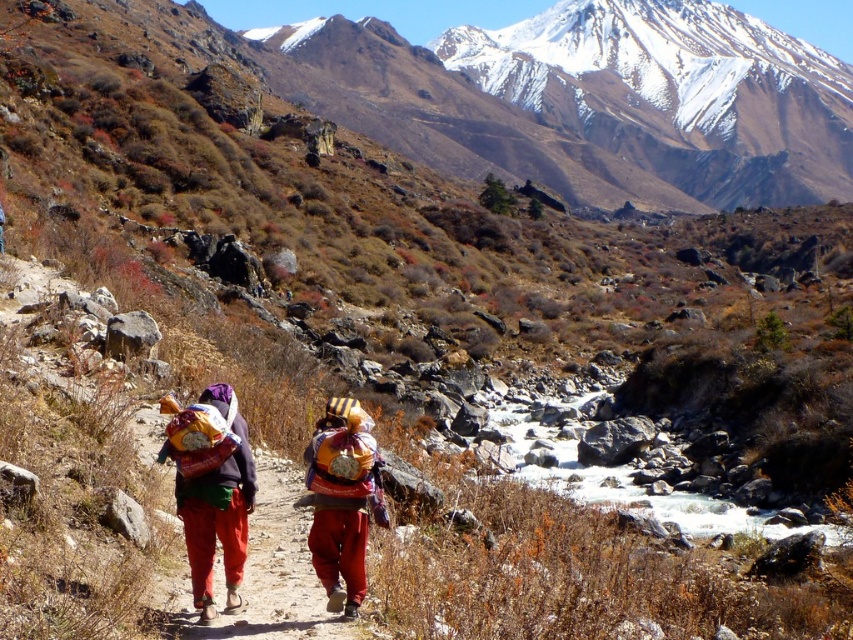
Question: Which point is closer to the camera?

Choices:
 (A) snowy rock mountain at upper center
 (B) matte red pants at center
 (C) reddish-brown fabric bag at center

Answer: (B)

Question: Which point is farther to the camera?

Choices:
 (A) (494, 86)
 (B) (202, 467)

Answer: (A)

Question: Considering the relative positions of matte red pants at center and reddish-brown fabric bag at center in the image provided, where is matte red pants at center located with respect to reddish-brown fabric bag at center?

Choices:
 (A) above
 (B) below

Answer: (B)

Question: Among these objects, which one is nearest to the camera?

Choices:
 (A) matte red pants at center
 (B) reddish-brown fabric bag at center
 (C) snowy rock mountain at upper center

Answer: (A)

Question: Does snowy rock mountain at upper center come in front of matte red pants at center?

Choices:
 (A) no
 (B) yes

Answer: (A)

Question: Is matte red pants at center wider than reddish-brown fabric bag at center?

Choices:
 (A) no
 (B) yes

Answer: (A)